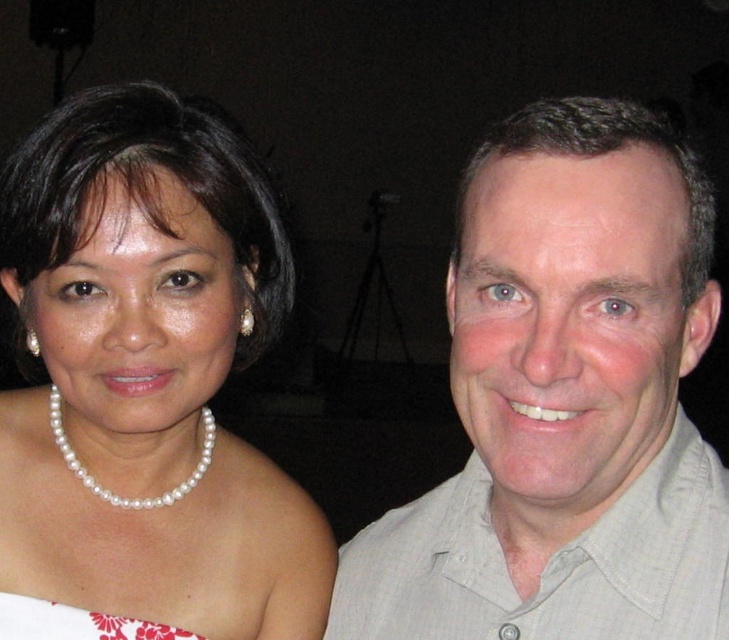
Question: Which point is closer to the camera?

Choices:
 (A) light beige shirt at right
 (B) pearl necklace at center
 (C) white floral fabric dress at lower left

Answer: (A)

Question: Is light beige shirt at right thinner than pearl necklace at center?

Choices:
 (A) no
 (B) yes

Answer: (B)

Question: Which point is farther from the camera taking this photo?

Choices:
 (A) (85, 636)
 (B) (117, 256)
 (C) (634, 605)

Answer: (A)

Question: Can you confirm if pearl necklace at center is thinner than pearl necklace at left?

Choices:
 (A) no
 (B) yes

Answer: (A)

Question: Which of these objects is positioned closest to the light beige shirt at right?

Choices:
 (A) pearl necklace at left
 (B) white floral fabric dress at lower left

Answer: (A)

Question: Is light beige shirt at right further to the viewer compared to pearl necklace at center?

Choices:
 (A) yes
 (B) no

Answer: (B)